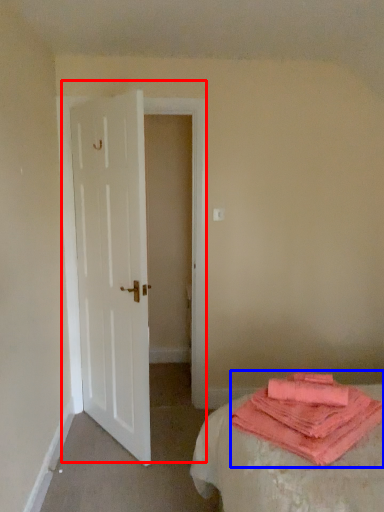
Question: Which of the following is the farthest to the observer, door (highlighted by a red box) or cloth (highlighted by a blue box)?

Choices:
 (A) door
 (B) cloth

Answer: (A)